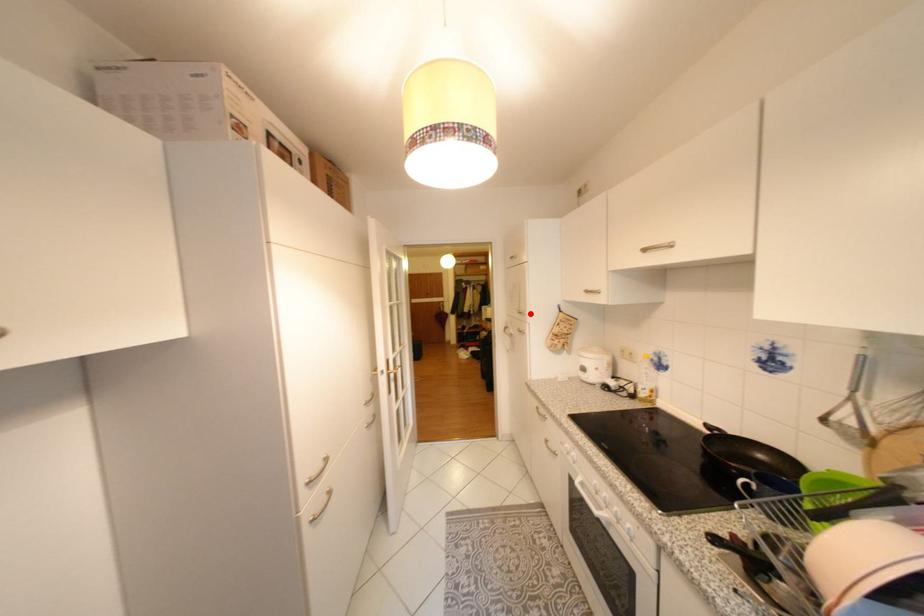
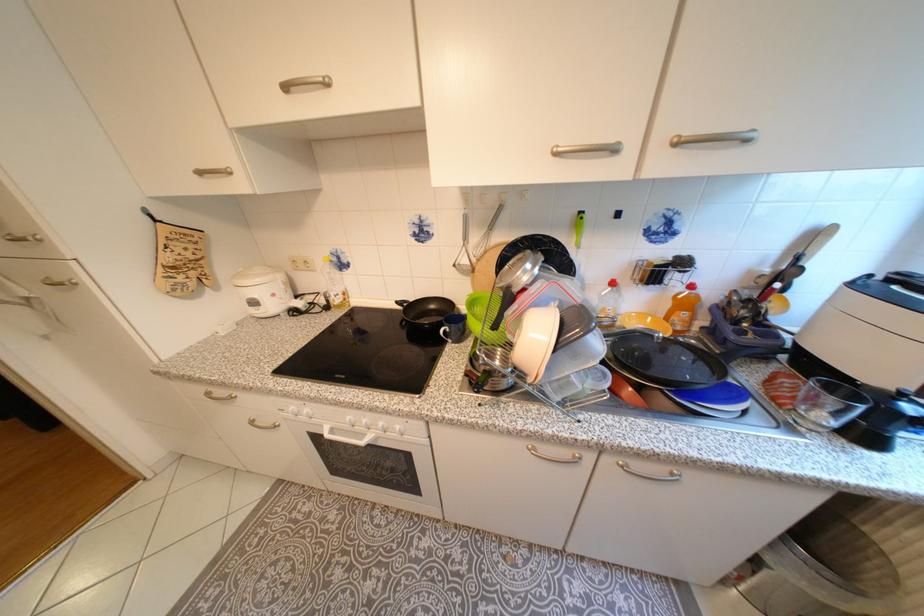
Question: I am providing you with two images of the same scene from different viewpoints. Image1 has a red point marked. In image2, the corresponding 3D location appears at what relative position? Reply with the corresponding letter.

Choices:
 (A) Closer
 (B) Farther

Answer: (B)